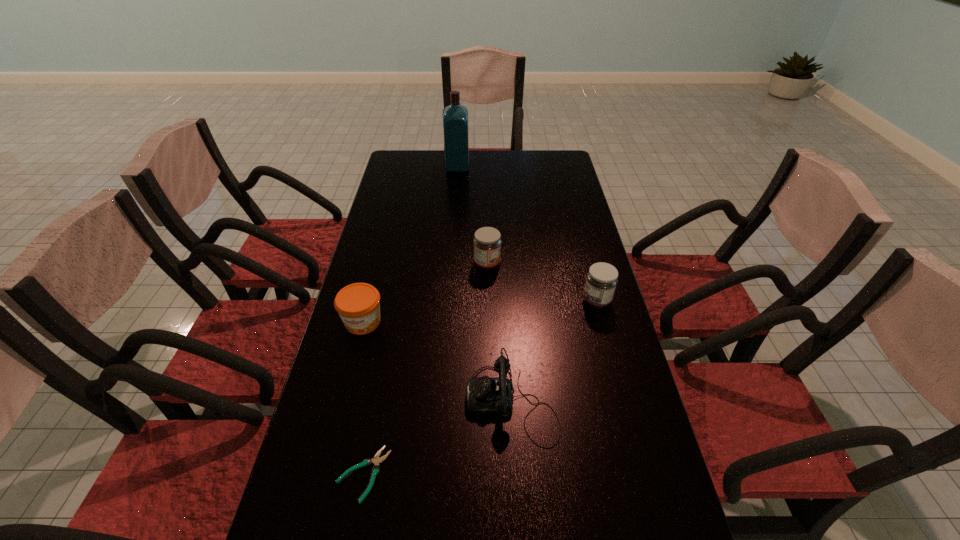
This screenshot has height=540, width=960. I want to click on free spot located 0.340m on the front label of the rightmost jam, so click(x=464, y=301).

Find the location of a particular element. This screenshot has width=960, height=540. vacant space located on the front label of the rightmost jam is located at coordinates (481, 301).

Where is `vacant region located 0.370m on the front label of the rightmost jam`? vacant region located 0.370m on the front label of the rightmost jam is located at coordinates tap(453, 301).

Locate an element on the screen. This screenshot has width=960, height=540. free space located 0.200m on the front label of the shortest jam is located at coordinates (342, 406).

The width and height of the screenshot is (960, 540). What are the coordinates of `free spot located 0.070m on the front-facing side of the telephone` in the screenshot? It's located at (436, 401).

Locate an element on the screen. This screenshot has height=540, width=960. vacant space located 0.240m on the front-facing side of the telephone is located at coordinates 364,401.

Locate an element on the screen. The image size is (960, 540). free space located 0.200m on the front-facing side of the telephone is located at coordinates (380, 401).

Identify the location of free region located 0.200m on the back of the pliers. This screenshot has height=540, width=960. coord(383,369).

Image resolution: width=960 pixels, height=540 pixels. Identify the location of object at the far edge. (455, 117).

Where is `jam located at the left edge`? The image size is (960, 540). jam located at the left edge is located at coordinates (358, 304).